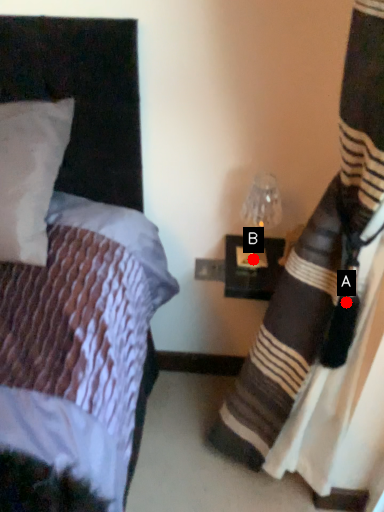
Question: Two points are circled on the image, labeled by A and B beside each circle. Which point is further to the camera?

Choices:
 (A) A is further
 (B) B is further

Answer: (B)